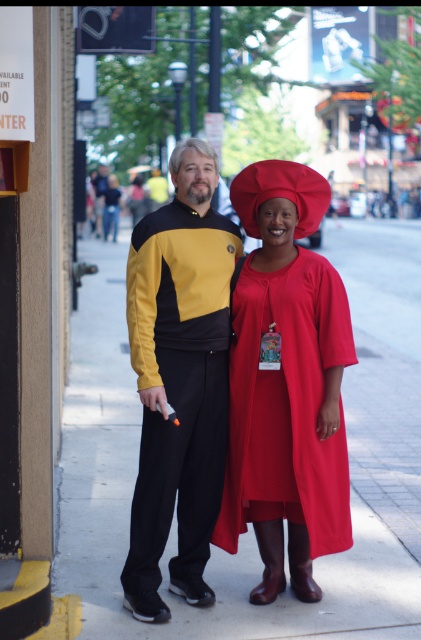
Which is in front, point (277, 202) or point (207, 528)?

Point (277, 202)

Which of these two, matte red dress at center or yellow matte uniform at center, stands taller?

yellow matte uniform at center is taller.

Identify the location of matte red dress at center. This screenshot has height=640, width=421. (285, 385).

You are a GUI agent. You are given a task and a screenshot of the screen. Output one action in this format:
    pyautogui.click(x=<x>, y=<y>)
    Task: Click on the smooth concrete pavement at center
    This screenshot has width=421, height=640.
    Given the screenshot: What is the action you would take?
    pyautogui.click(x=250, y=525)

Is smooth concrete pavement at center taller than matte red dress at center?

Indeed, smooth concrete pavement at center has a greater height compared to matte red dress at center.

Locate an element on the screen. smooth concrete pavement at center is located at coordinates (250, 525).

Where is `smooth concrete pavement at center`? This screenshot has width=421, height=640. smooth concrete pavement at center is located at coordinates point(250,525).

Image resolution: width=421 pixels, height=640 pixels. What are the coordinates of `smooth concrete pavement at center` in the screenshot? It's located at (250, 525).

Who is more distant from viewer, (127, 499) or (181, 288)?

The point (127, 499) is behind.

Where is `smooth concrete pavement at center`? This screenshot has width=421, height=640. smooth concrete pavement at center is located at coordinates (250, 525).